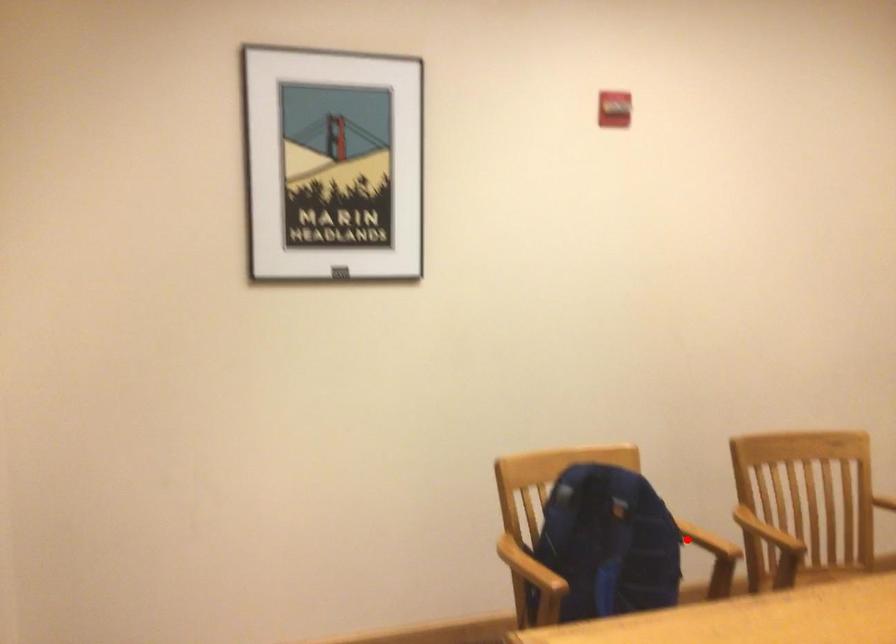
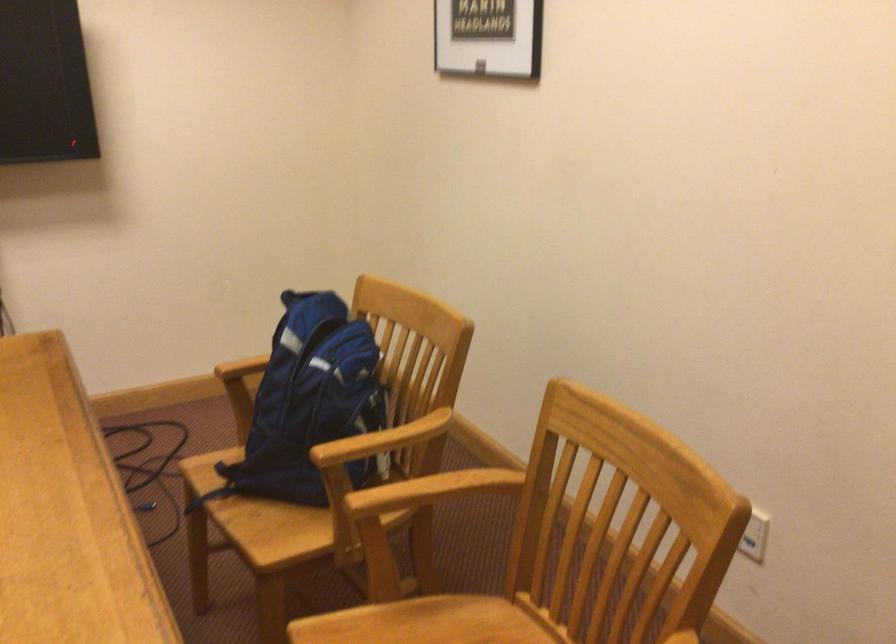
Question: I am providing you with two images of the same scene from different viewpoints. A red point is shown in image1. For the corresponding object point in image2, is it positioned nearer or farther from the camera?

Choices:
 (A) Nearer
 (B) Farther

Answer: (A)